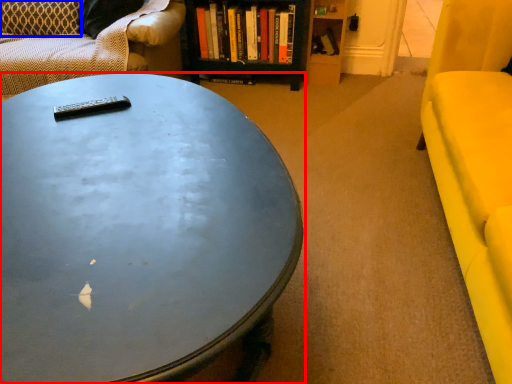
Question: Which of the following is the farthest to the observer, coffee table (highlighted by a red box) or pillow (highlighted by a blue box)?

Choices:
 (A) coffee table
 (B) pillow

Answer: (B)